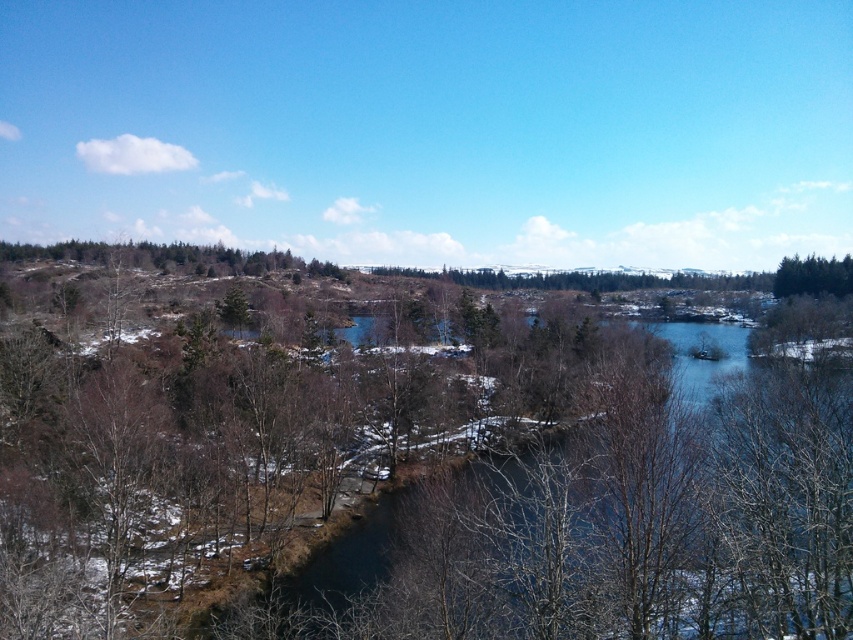
Question: Which point is closer to the camera?

Choices:
 (A) (834, 269)
 (B) (294, 493)

Answer: (B)

Question: Where is brown leafless tree at center located in relation to green leafy trees at upper right in the image?

Choices:
 (A) left
 (B) right

Answer: (A)

Question: Among these objects, which one is nearest to the camera?

Choices:
 (A) green leafy trees at upper right
 (B) brown leafless tree at center

Answer: (B)

Question: Can you confirm if brown leafless tree at center is wider than green leafy trees at upper right?

Choices:
 (A) yes
 (B) no

Answer: (A)

Question: Is brown leafless tree at center positioned behind green leafy trees at upper right?

Choices:
 (A) yes
 (B) no

Answer: (B)

Question: Which object appears closest to the camera in this image?

Choices:
 (A) brown leafless tree at center
 (B) green leafy trees at upper right

Answer: (A)